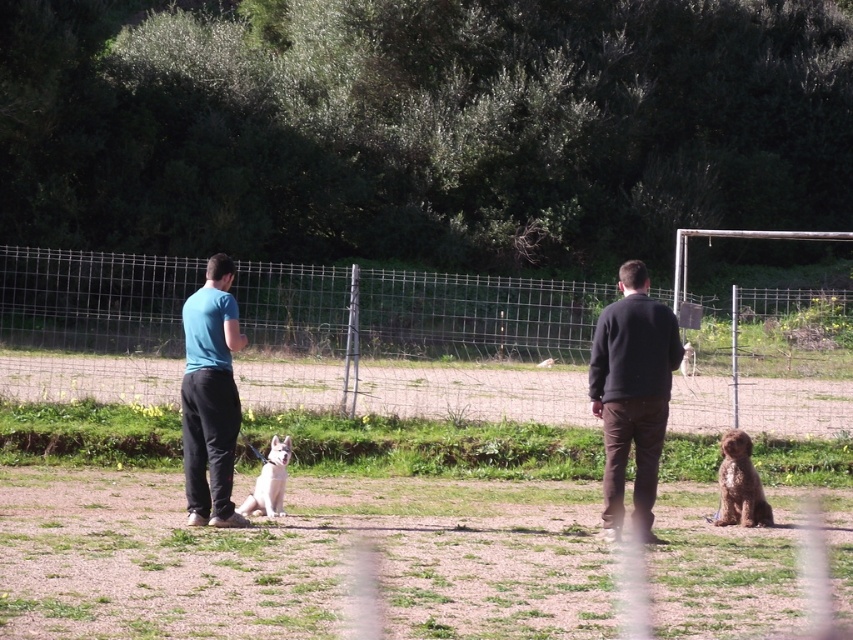
You are standing at the point marked by the coordinates point [299,557] in the image. What is the name of the object located at this position?

The point [299,557] indicates brown dirt field at center.

You are a photographer setting up a tripod in the park. You want to capture a photo that includes both the metallic wire fence at center and the white fur dog at center without any obstructions. Given that your camera has a maximum focal length that allows for a 50 feet field of view, will you be able to frame both subjects within the shot?

The metallic wire fence at center and white fur dog at center are 39.80 feet apart, which is within the 50 feet field of view of your camera. Therefore, you can frame both subjects without obstructions.